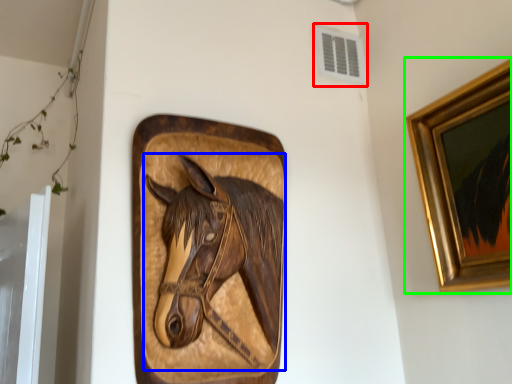
Question: Based on their relative distances, which object is nearer to air conditioning (highlighted by a red box)? Choose from horse (highlighted by a blue box) and picture frame (highlighted by a green box).

Choices:
 (A) horse
 (B) picture frame

Answer: (B)